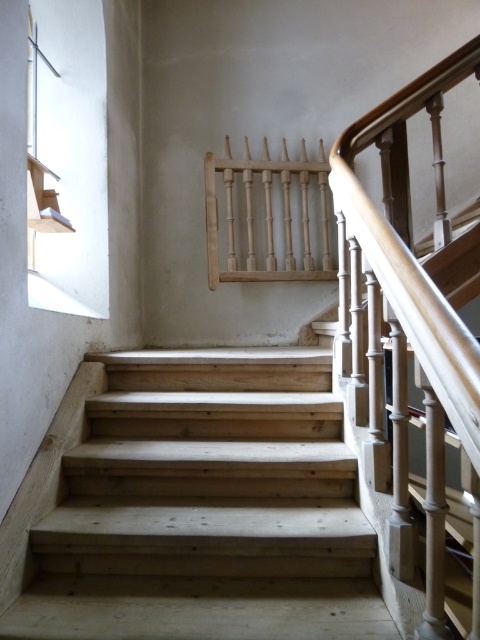
Question: Does natural wood stairs at center appear under light brown polished wood handrail at upper right?

Choices:
 (A) yes
 (B) no

Answer: (A)

Question: Which of the following is the farthest from the observer?

Choices:
 (A) light brown polished wood handrail at upper right
 (B) natural wood stairs at center

Answer: (B)

Question: Which point is closer to the camera?

Choices:
 (A) (309, 534)
 (B) (396, 246)

Answer: (B)

Question: Can you confirm if natural wood stairs at center is thinner than light brown polished wood handrail at upper right?

Choices:
 (A) no
 (B) yes

Answer: (A)

Question: Which object appears closest to the camera in this image?

Choices:
 (A) natural wood stairs at center
 (B) light brown polished wood handrail at upper right

Answer: (B)

Question: In this image, where is natural wood stairs at center located relative to light brown polished wood handrail at upper right?

Choices:
 (A) right
 (B) left

Answer: (B)